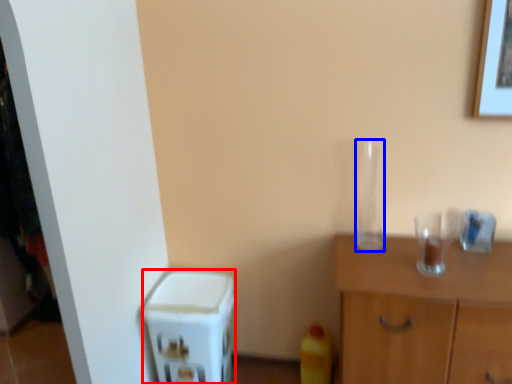
Question: Which object is further to the camera taking this photo, appliance (highlighted by a red box) or glass vase (highlighted by a blue box)?

Choices:
 (A) appliance
 (B) glass vase

Answer: (A)